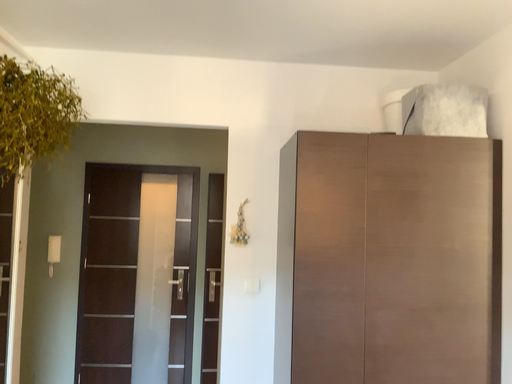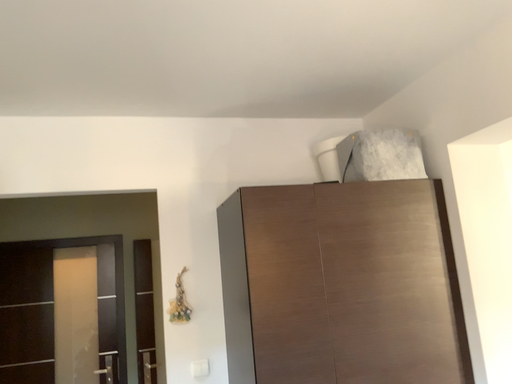
Question: Which way did the camera rotate in the video?

Choices:
 (A) rotated downward
 (B) rotated upward

Answer: (B)